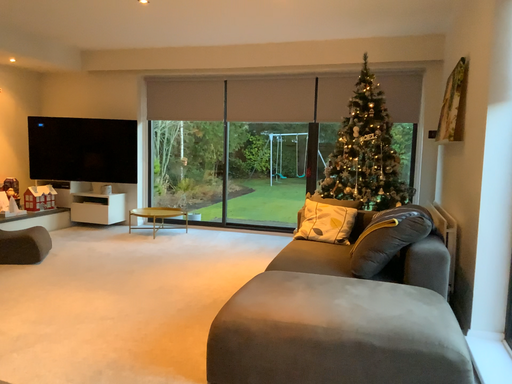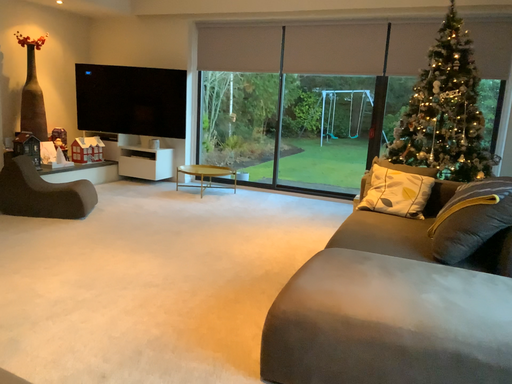
Question: Which way did the camera rotate in the video?

Choices:
 (A) rotated left
 (B) rotated right

Answer: (A)